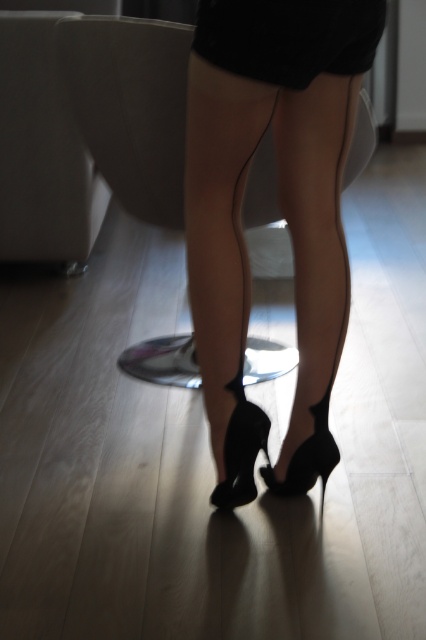
You are a fashion designer observing the image of a person wearing black satin stockings at center and a black matte dress at center. Which item of clothing is positioned higher on the leg?

The black satin stockings at center are taller than the black matte dress at center, meaning they extend higher up the leg.

You are a fashion designer trying to place a small accessory between the black suede heels at center and the black satin stockings at center. What is the minimum length of the accessory needed to fit between them?

The black suede heels at center and black satin stockings at center are 3.93 inches apart, so the accessory must be at least 3.93 inches long to fit between them.

You are a fashion designer observing the lower body outfit. You need to determine which item is closer to you when looking at the black satin stockings at center and the black matte dress at center. Which one is nearer?

The black satin stockings at center are closer to you than the black matte dress at center.